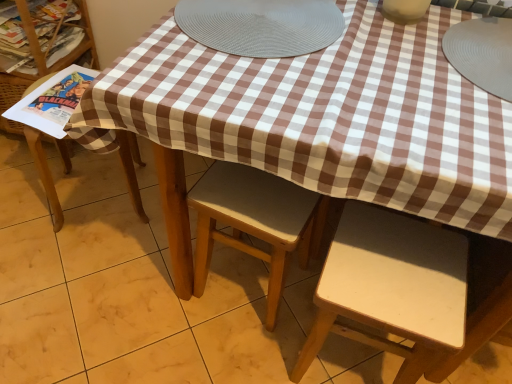
Locate an element on the screen. This screenshot has height=384, width=512. vacant space that is to the left of wooden chair at left, which ranks as the 1th chair in left-to-right order is located at coordinates 25,195.